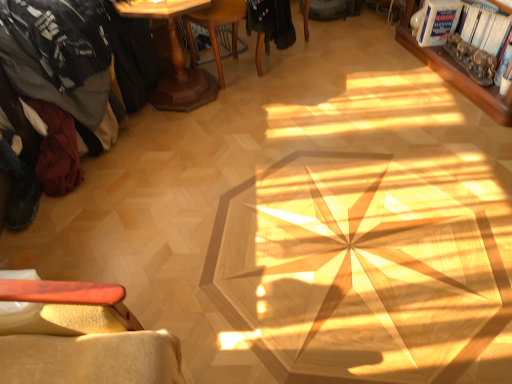
This screenshot has height=384, width=512. Identify the location of vacant space to the right of wooden at center, the second chair when ordered from right to left. (295, 81).